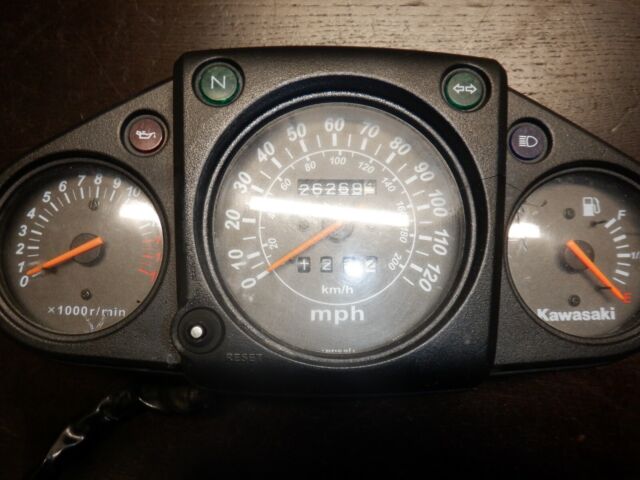
You are a GUI agent. You are given a task and a screenshot of the screen. Output one action in this format:
    pyautogui.click(x=<x>, y=<y>)
    Task: Click on the neutral light
    
    Given the screenshot: What is the action you would take?
    pyautogui.click(x=219, y=80)